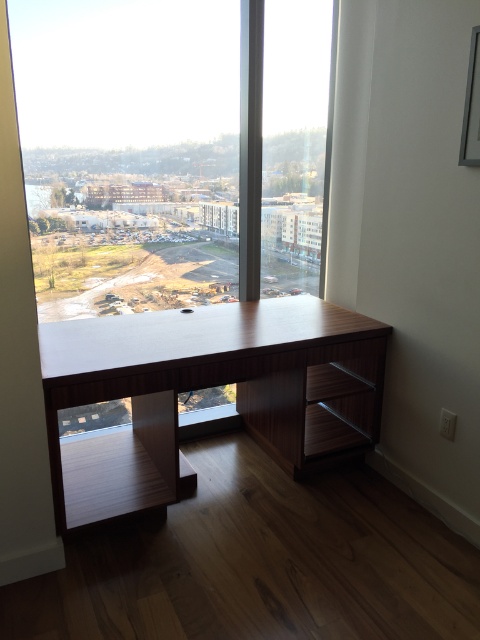
Question: Can you confirm if transparent glass window at center is thinner than wooden desk at center?

Choices:
 (A) yes
 (B) no

Answer: (A)

Question: Can you confirm if transparent glass window at center is thinner than wooden desk at center?

Choices:
 (A) yes
 (B) no

Answer: (A)

Question: Which point appears farthest from the camera in this image?

Choices:
 (A) (126, 365)
 (B) (186, 60)

Answer: (B)

Question: Which object is farther from the camera taking this photo?

Choices:
 (A) wooden desk at center
 (B) transparent glass window at center

Answer: (B)

Question: Is transparent glass window at center below wooden desk at center?

Choices:
 (A) yes
 (B) no

Answer: (B)